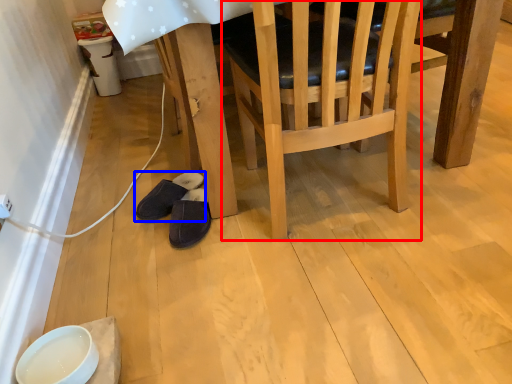
Question: Which object appears farthest to the camera in this image, chair (highlighted by a red box) or footwear (highlighted by a blue box)?

Choices:
 (A) chair
 (B) footwear

Answer: (B)